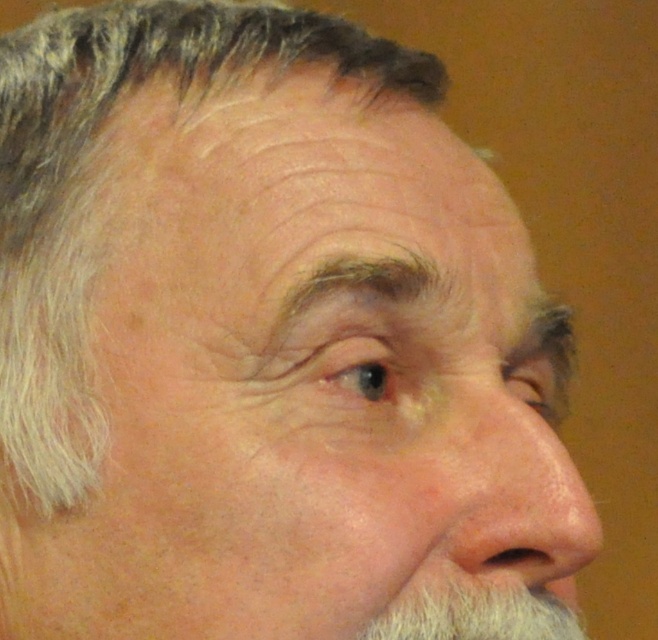
Question: Is dry skin nose at center bigger than white fuzzy beard at lower right?

Choices:
 (A) yes
 (B) no

Answer: (A)

Question: Which object is farther from the camera taking this photo?

Choices:
 (A) white fuzzy beard at lower right
 (B) dry skin nose at center
 (C) gray matte hair at upper left

Answer: (C)

Question: Is gray matte hair at upper left closer to camera compared to dry skin nose at center?

Choices:
 (A) yes
 (B) no

Answer: (B)

Question: Estimate the real-world distances between objects in this image. Which object is closer to the dry skin nose at center?

Choices:
 (A) white fuzzy beard at lower right
 (B) gray matte hair at upper left

Answer: (A)

Question: Which of these objects is positioned farthest from the gray matte hair at upper left?

Choices:
 (A) dry skin nose at center
 (B) white fuzzy beard at lower right

Answer: (B)

Question: Can you confirm if dry skin nose at center is positioned to the right of white fuzzy beard at lower right?

Choices:
 (A) yes
 (B) no

Answer: (A)